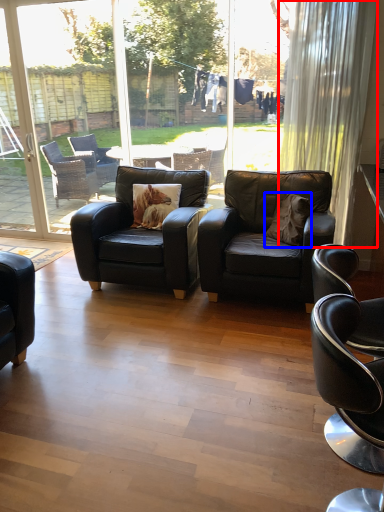
Question: Which of the following is the farthest to the observer, curtain (highlighted by a red box) or pillow (highlighted by a blue box)?

Choices:
 (A) curtain
 (B) pillow

Answer: (A)